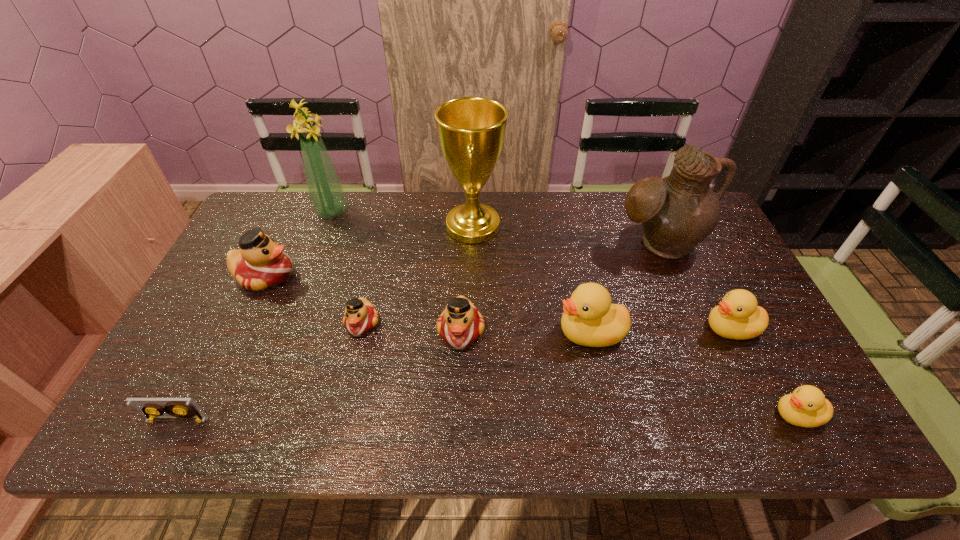
Image resolution: width=960 pixels, height=540 pixels. Identify the location of the second smallest yellow duck. (738, 317).

Find the location of a particular element. This screenshot has width=960, height=540. the fifth duck from right to left is located at coordinates (360, 316).

Where is `the seventh object from right to left`? Image resolution: width=960 pixels, height=540 pixels. the seventh object from right to left is located at coordinates (360, 316).

What are the coordinates of `the nearest duck` in the screenshot? It's located at (807, 406).

In order to click on the nearest yellow duck in this screenshot , I will do `click(807, 406)`.

The width and height of the screenshot is (960, 540). I want to click on the shortest object, so click(x=176, y=409).

Where is `videotape`? This screenshot has height=540, width=960. videotape is located at coordinates (176, 409).

This screenshot has width=960, height=540. Identify the location of vacant position located 0.350m on the front-facing side of the bouquet. (451, 211).

At what (x,y) coordinates should I click in order to perform the action: click on vacant space situated 0.390m by the handles of the award. Please return your answer as a coordinate pair (x, y). Image resolution: width=960 pixels, height=540 pixels. Looking at the image, I should click on (622, 227).

This screenshot has height=540, width=960. Identify the location of vacant space located 0.210m at the spout of the brown pitcher. (693, 325).